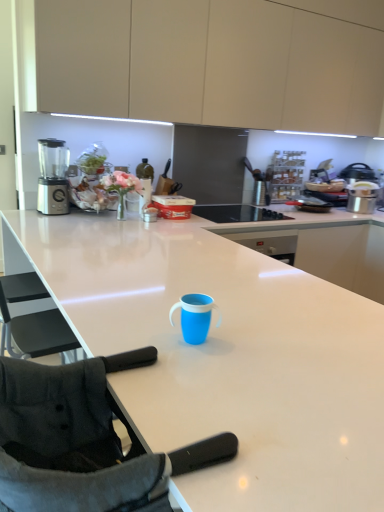
Question: Considering the relative sizes of black fabric folding chair at lower left and white glossy countertop at center in the image provided, is black fabric folding chair at lower left thinner than white glossy countertop at center?

Choices:
 (A) no
 (B) yes

Answer: (B)

Question: Does black fabric folding chair at lower left have a smaller size compared to white glossy countertop at center?

Choices:
 (A) no
 (B) yes

Answer: (B)

Question: Is black fabric folding chair at lower left in contact with white glossy countertop at center?

Choices:
 (A) no
 (B) yes

Answer: (A)

Question: Is black fabric folding chair at lower left facing away from white glossy countertop at center?

Choices:
 (A) no
 (B) yes

Answer: (A)

Question: Considering the relative positions of black fabric folding chair at lower left and white glossy countertop at center in the image provided, is black fabric folding chair at lower left behind white glossy countertop at center?

Choices:
 (A) no
 (B) yes

Answer: (B)

Question: From the image's perspective, does black fabric folding chair at lower left appear lower than white glossy countertop at center?

Choices:
 (A) yes
 (B) no

Answer: (B)

Question: Can you confirm if black fabric folding chair at lower left is smaller than matte beige cabinets at upper center?

Choices:
 (A) yes
 (B) no

Answer: (A)

Question: From the image's perspective, is black fabric folding chair at lower left under matte beige cabinets at upper center?

Choices:
 (A) no
 (B) yes

Answer: (B)

Question: Is black fabric folding chair at lower left at the left side of matte beige cabinets at upper center?

Choices:
 (A) yes
 (B) no

Answer: (A)

Question: Would you say black fabric folding chair at lower left is outside matte beige cabinets at upper center?

Choices:
 (A) yes
 (B) no

Answer: (A)

Question: From a real-world perspective, is black fabric folding chair at lower left below matte beige cabinets at upper center?

Choices:
 (A) no
 (B) yes

Answer: (B)

Question: Is black fabric folding chair at lower left taller than matte beige cabinets at upper center?

Choices:
 (A) yes
 (B) no

Answer: (B)

Question: Does satin silver blender at left have a lesser width compared to black glass cooktop at center?

Choices:
 (A) yes
 (B) no

Answer: (A)